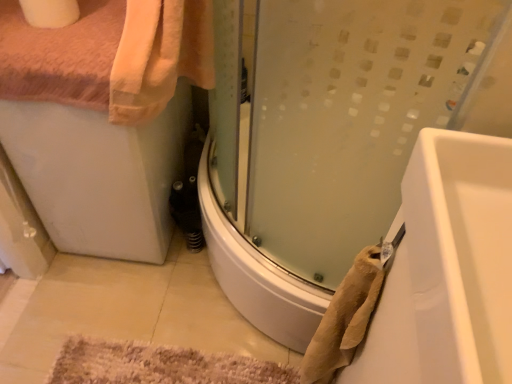
Locate an element on the screen. The height and width of the screenshot is (384, 512). vacant space underneath beige textured bath mat at lower center (from a real-world perspective) is located at coordinates (144, 358).